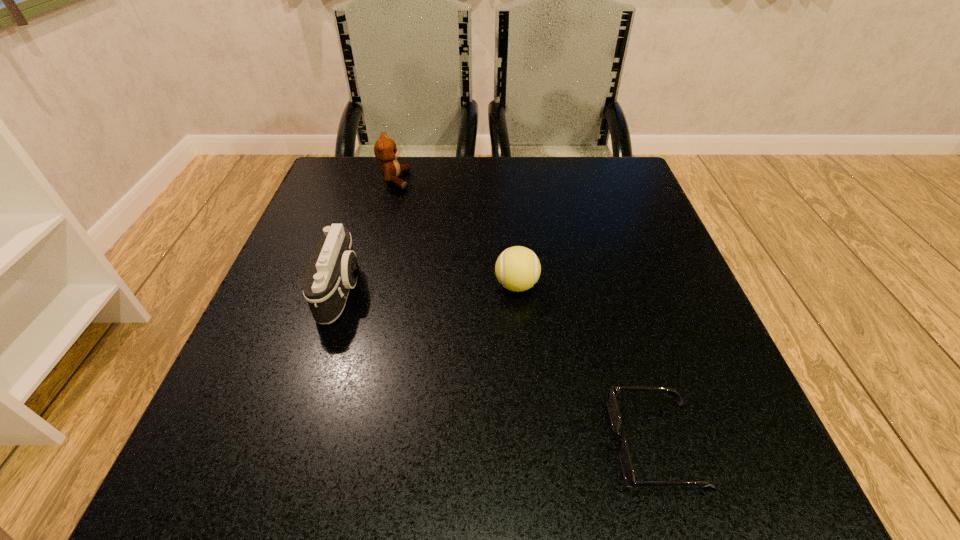
This screenshot has width=960, height=540. What are the coordinates of `the farthest object` in the screenshot? It's located at (385, 150).

This screenshot has width=960, height=540. What are the coordinates of `camera` in the screenshot? It's located at (333, 270).

The height and width of the screenshot is (540, 960). Find the location of `tennis ball`. tennis ball is located at coordinates (517, 268).

Where is `the third tallest object`? the third tallest object is located at coordinates (517, 268).

This screenshot has width=960, height=540. In order to click on the shortest object in this screenshot , I will do `click(625, 460)`.

Where is `the rightmost object`? the rightmost object is located at coordinates (625, 460).

Identify the location of vacant space located on the front-facing side of the teddy bear. (523, 180).

Find the location of a particular element. The width and height of the screenshot is (960, 540). vacant space located on the front lens of the camera is located at coordinates (565, 290).

Locate an element on the screen. Image resolution: width=960 pixels, height=540 pixels. free space located 0.050m on the back of the second object from right to left is located at coordinates (514, 253).

Image resolution: width=960 pixels, height=540 pixels. I want to click on free point located 0.350m on the front-facing side of the nearest object, so click(x=354, y=443).